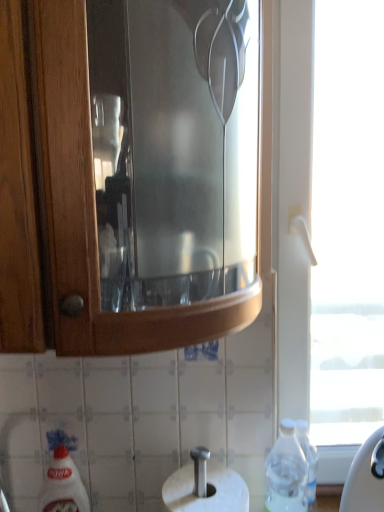
Question: In terms of size, does transparent plastic bottle at lower right appear bigger or smaller than transparent glass window at right?

Choices:
 (A) small
 (B) big

Answer: (A)

Question: From the image's perspective, relative to transparent glass window at right, is transparent plastic bottle at lower right above or below?

Choices:
 (A) above
 (B) below

Answer: (B)

Question: Which of these objects is positioned farthest from the transparent glass window at right?

Choices:
 (A) white glossy bottle at lower left
 (B) transparent plastic bottle at lower right

Answer: (A)

Question: Which is nearer to the transparent plastic bottle at lower right?

Choices:
 (A) white glossy bottle at lower left
 (B) transparent glass window at right

Answer: (A)